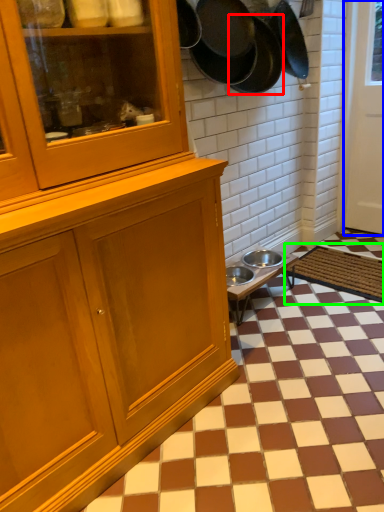
Question: Considering the real-world distances, which object is closest to frying pan (highlighted by a red box)? door (highlighted by a blue box) or doormat (highlighted by a green box).

Choices:
 (A) door
 (B) doormat

Answer: (A)